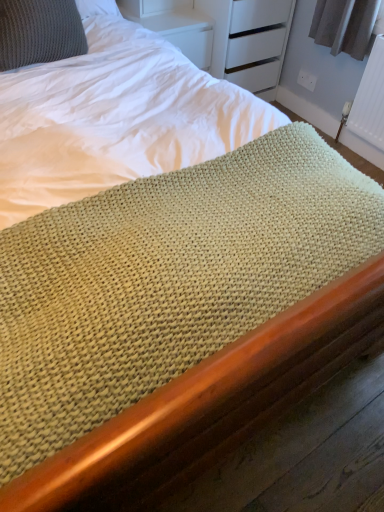
Question: From a real-world perspective, is white textured radiator at upper right physically located above or below knitted gray pillow at upper left?

Choices:
 (A) below
 (B) above

Answer: (A)

Question: Is white textured radiator at upper right wider or thinner than knitted gray pillow at upper left?

Choices:
 (A) thin
 (B) wide

Answer: (A)

Question: Is point (360, 115) closer or farther from the camera than point (44, 15)?

Choices:
 (A) closer
 (B) farther

Answer: (B)

Question: Is knitted gray pillow at upper left spatially inside white textured radiator at upper right, or outside of it?

Choices:
 (A) inside
 (B) outside

Answer: (B)

Question: Does point (18, 42) appear closer or farther from the camera than point (382, 58)?

Choices:
 (A) closer
 (B) farther

Answer: (A)

Question: Considering their positions, is knitted gray pillow at upper left located in front of or behind white textured radiator at upper right?

Choices:
 (A) behind
 (B) front

Answer: (B)

Question: Considering the positions of knitted gray pillow at upper left and white textured radiator at upper right in the image, is knitted gray pillow at upper left wider or thinner than white textured radiator at upper right?

Choices:
 (A) wide
 (B) thin

Answer: (A)